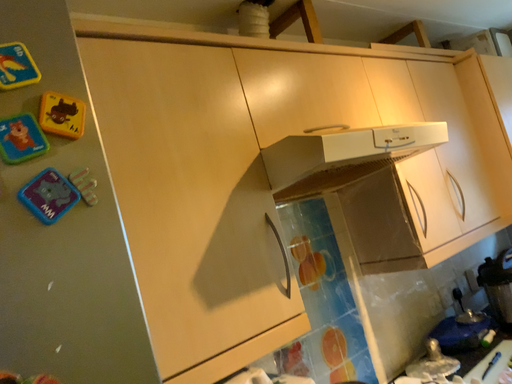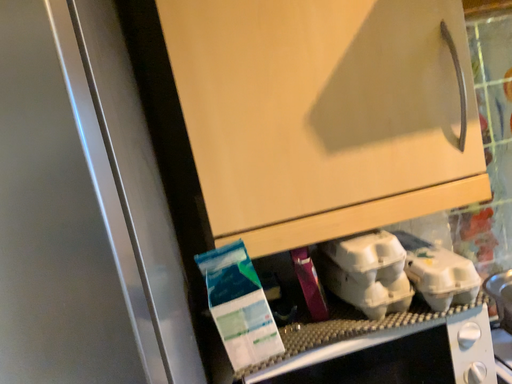
Question: How did the camera likely rotate when shooting the video?

Choices:
 (A) rotated right
 (B) rotated left

Answer: (B)